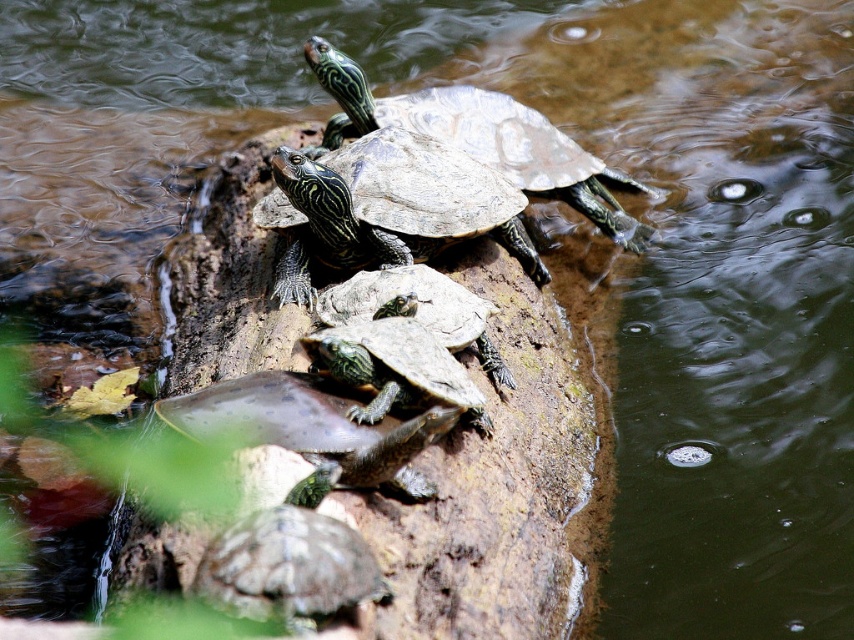
Question: Does green scaly turtle at center appear under green textured tortoise at center?

Choices:
 (A) yes
 (B) no

Answer: (A)

Question: From the image, what is the correct spatial relationship of shiny dark green tortoise at center in relation to shiny green tortoise at upper center?

Choices:
 (A) above
 (B) below

Answer: (B)

Question: Estimate the real-world distances between objects in this image. Which object is farther from the green scaly turtle at center?

Choices:
 (A) shiny green tortoise at upper center
 (B) green scaly tortoise at center

Answer: (A)

Question: Which of the following is the farthest from the observer?

Choices:
 (A) shiny green tortoise at lower center
 (B) green scaly turtle at center

Answer: (B)

Question: Which point appears farthest from the camera in this image?

Choices:
 (A) click(x=367, y=577)
 (B) click(x=648, y=236)
 (C) click(x=342, y=234)

Answer: (B)

Question: Is shiny green tortoise at lower center further to the viewer compared to green scaly turtle at center?

Choices:
 (A) no
 (B) yes

Answer: (A)